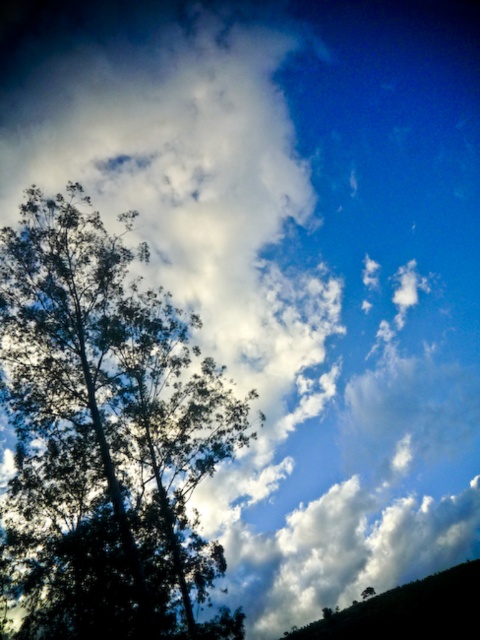
Question: Which of the following is the farthest from the observer?

Choices:
 (A) (410, 609)
 (B) (240, 433)

Answer: (A)

Question: Is dark green leafy tree at left below dark green textured hillside at lower right?

Choices:
 (A) no
 (B) yes

Answer: (A)

Question: Does dark green leafy tree at left appear under dark green textured hillside at lower right?

Choices:
 (A) yes
 (B) no

Answer: (B)

Question: Does dark green leafy tree at left have a smaller size compared to dark green textured hillside at lower right?

Choices:
 (A) no
 (B) yes

Answer: (A)